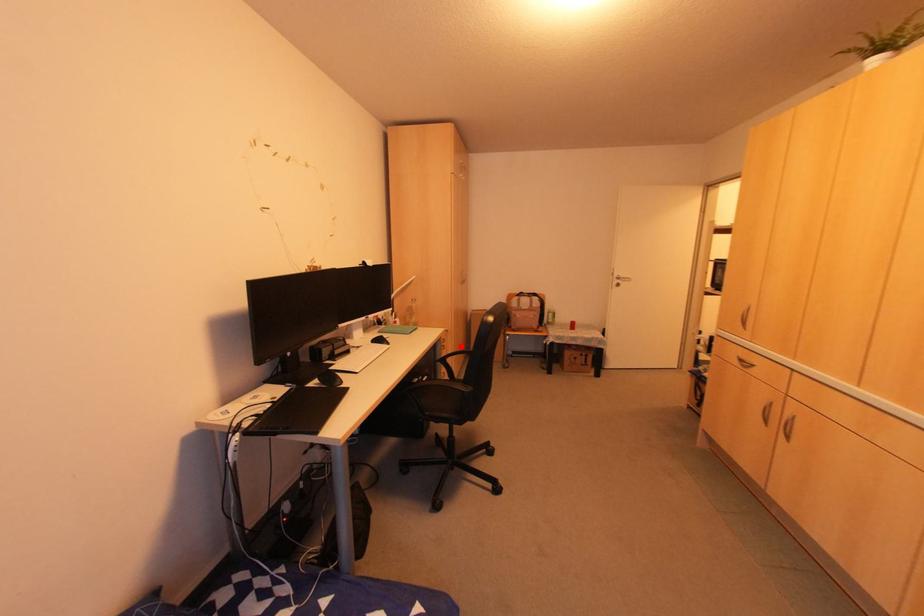
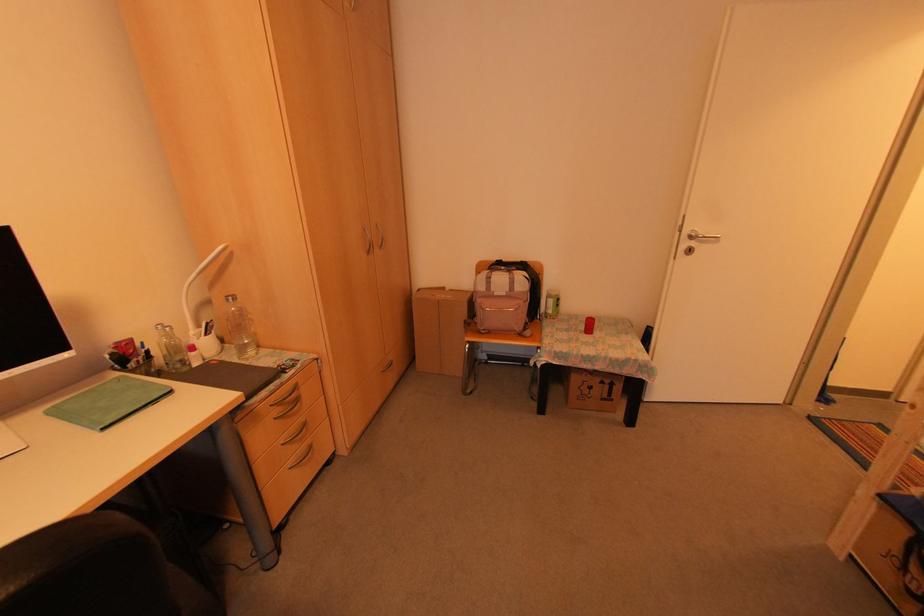
Question: I am providing you with two images of the same scene from different viewpoints. A red point is marked on the first image. Is the red point's position out of view in image 2?

Choices:
 (A) Yes
 (B) No

Answer: (B)